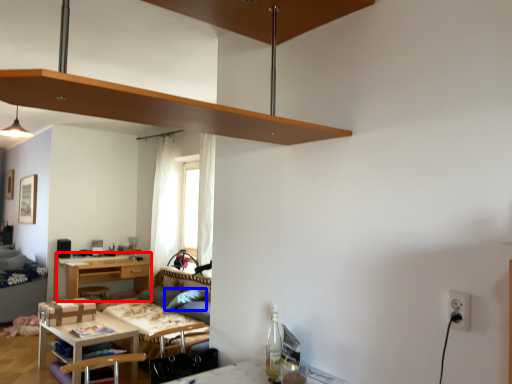
Question: Which of the following is the closest to the observer, desk (highlighted by a red box) or pillow (highlighted by a blue box)?

Choices:
 (A) desk
 (B) pillow

Answer: (B)